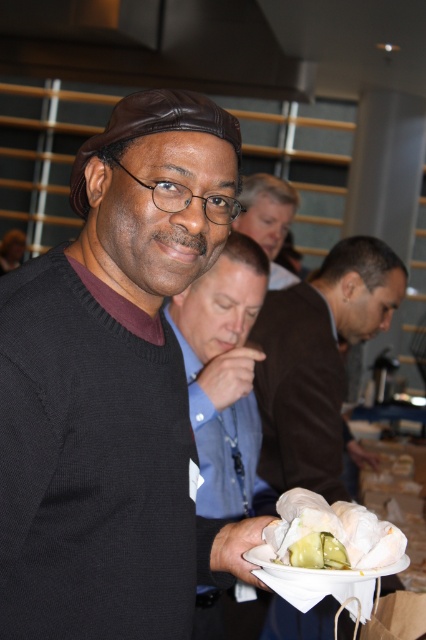
Looking at this image, between white paper wrapped sandwich at lower center and white paper plate at lower center, which one has more height?

Standing taller between the two is white paper wrapped sandwich at lower center.

Can you confirm if white paper wrapped sandwich at lower center is smaller than white paper plate at lower center?

Actually, white paper wrapped sandwich at lower center might be larger than white paper plate at lower center.

At what (x,y) coordinates should I click in order to perform the action: click on white paper wrapped sandwich at lower center. Please return your answer as a coordinate pair (x, y). Looking at the image, I should click on (334, 529).

What do you see at coordinates (115, 388) in the screenshot? I see `black matte sweater at center` at bounding box center [115, 388].

Is black matte sweater at center above white paper plate at lower center?

Correct, black matte sweater at center is located above white paper plate at lower center.

Measure the distance between black matte sweater at center and camera.

A distance of 33.53 inches exists between black matte sweater at center and camera.

In order to click on black matte sweater at center in this screenshot , I will do `click(115, 388)`.

Is point (333, 401) farther from camera compared to point (385, 563)?

Yes, it is.

Does brown leather jacket at center appear over white paper wrapped sandwich at lower center?

Correct, brown leather jacket at center is located above white paper wrapped sandwich at lower center.

Where is `brown leather jacket at center`? The width and height of the screenshot is (426, 640). brown leather jacket at center is located at coordinates (317, 358).